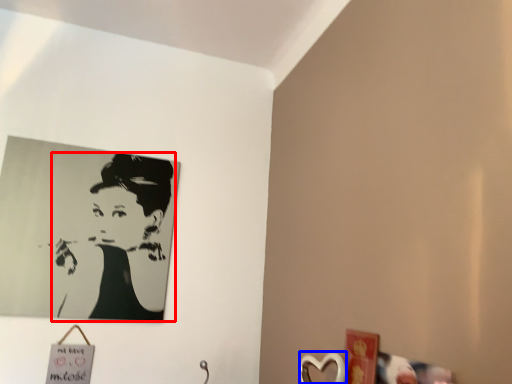
Question: Which object is closer to the camera taking this photo, woman (highlighted by a red box) or picture frame (highlighted by a blue box)?

Choices:
 (A) woman
 (B) picture frame

Answer: (B)